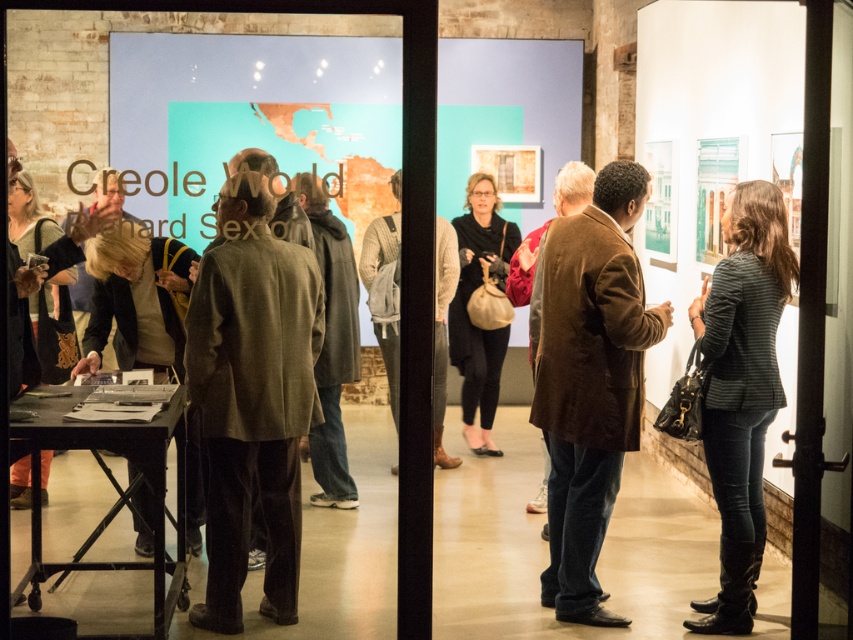
You are a museum attendant who needs to place two jackets on a narrow display table. The table can only accommodate items with a total width of 1 meter. If the brown suede jacket at center and the dark brown leather jacket at left are placed side by side, will they fit together on the table?

The brown suede jacket at center has a lesser width compared to dark brown leather jacket at left. If combined, their total width would exceed 1 meter, so they cannot fit together on the table.

You are a photographer trying to capture both the brown suede jacket at center and the striped fabric jacket at right in a single frame. Based on their sizes, which jacket will appear larger in the photo?

The brown suede jacket at center will appear larger in the photo because it is taller than the striped fabric jacket at right.